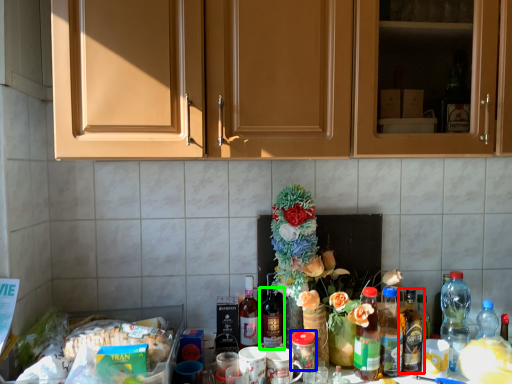
Question: Considering the real-world distances, which object is closest to bottle (highlighted by a red box)? beverage (highlighted by a blue box) or bottle (highlighted by a green box).

Choices:
 (A) beverage
 (B) bottle

Answer: (A)